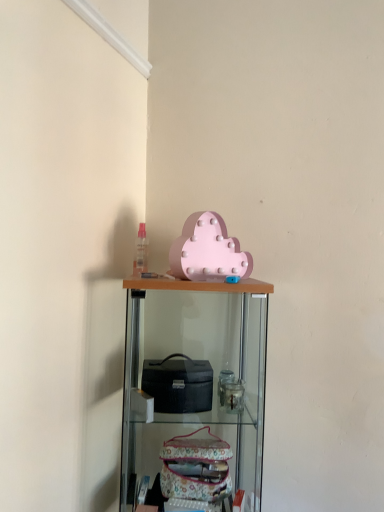
Question: Relative to wooden shelf at center, is matte pink cloud at upper center in front or behind?

Choices:
 (A) front
 (B) behind

Answer: (B)

Question: Considering the positions of matte pink cloud at upper center and wooden shelf at center in the image, is matte pink cloud at upper center wider or thinner than wooden shelf at center?

Choices:
 (A) wide
 (B) thin

Answer: (B)

Question: Does point (213, 273) appear closer or farther from the camera than point (188, 339)?

Choices:
 (A) closer
 (B) farther

Answer: (A)

Question: Based on their positions, is wooden shelf at center located to the left or right of matte pink cloud at upper center?

Choices:
 (A) right
 (B) left

Answer: (B)

Question: Relative to matte pink cloud at upper center, is wooden shelf at center in front or behind?

Choices:
 (A) front
 (B) behind

Answer: (A)

Question: Is wooden shelf at center bigger or smaller than matte pink cloud at upper center?

Choices:
 (A) small
 (B) big

Answer: (B)

Question: From the image's perspective, is wooden shelf at center positioned above or below matte pink cloud at upper center?

Choices:
 (A) above
 (B) below

Answer: (B)